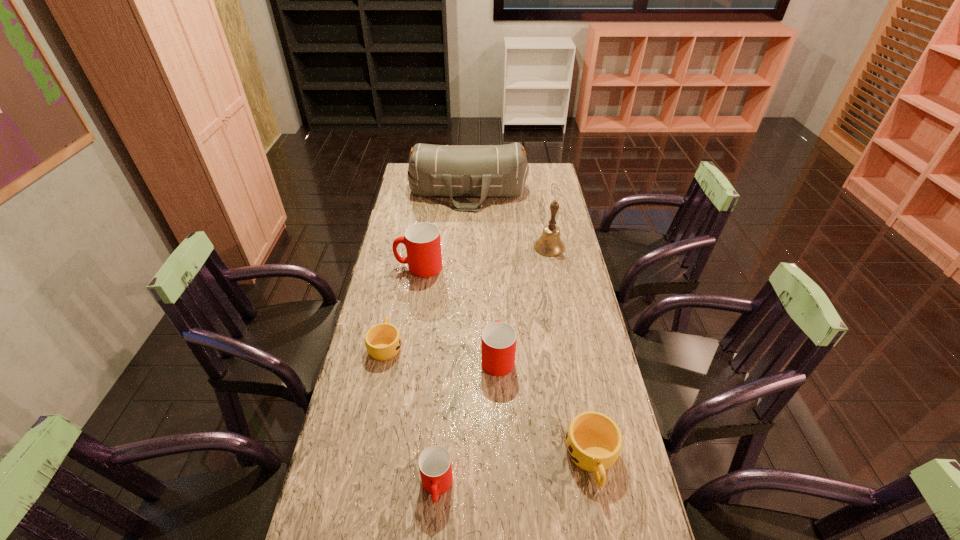
Identify the location of free space located on the front of the smaller beige cup. (377, 386).

Where is `object at the far edge`? The height and width of the screenshot is (540, 960). object at the far edge is located at coordinates (483, 171).

In order to click on duffel bag present at the left edge in this screenshot , I will do `click(483, 171)`.

This screenshot has width=960, height=540. In order to click on duffel bag present at the right edge in this screenshot , I will do `click(483, 171)`.

The width and height of the screenshot is (960, 540). What are the coordinates of `bell situated at the right edge` in the screenshot? It's located at (549, 244).

Locate an element on the screen. cup that is at the right edge is located at coordinates (593, 440).

Where is `object that is at the far left corner`? The height and width of the screenshot is (540, 960). object that is at the far left corner is located at coordinates (483, 171).

You are a GUI agent. You are given a task and a screenshot of the screen. Output one action in this format:
    pyautogui.click(x=<x>, y=<y>)
    Task: Click on the object present at the far right corner
    The image size is (960, 540).
    Given the screenshot: What is the action you would take?
    pyautogui.click(x=483, y=171)

The height and width of the screenshot is (540, 960). In the image, there is a desktop. What are the coordinates of `vacant space at the left edge` in the screenshot? It's located at (411, 318).

Image resolution: width=960 pixels, height=540 pixels. I want to click on vacant region at the right edge of the desktop, so click(x=563, y=232).